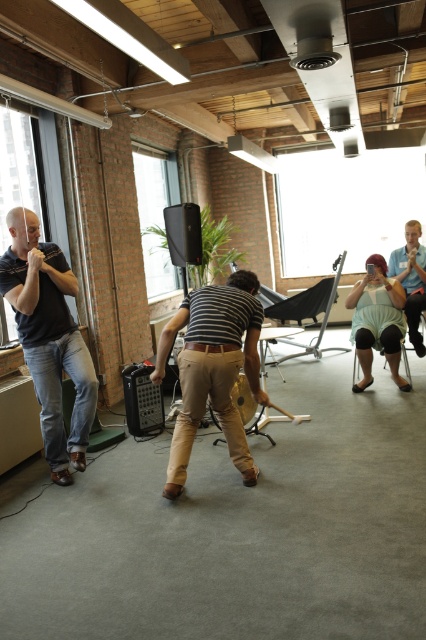
Is striped cotton shirt at center shorter than brown leather belt at center?

Incorrect, striped cotton shirt at center's height does not fall short of brown leather belt at center's.

Is striped cotton shirt at center above brown leather belt at center?

No.

This screenshot has height=640, width=426. Find the location of `striped cotton shirt at center`. striped cotton shirt at center is located at coordinates (213, 369).

Can you confirm if matte black shirt at left is wider than matte blue shirt at center?

Incorrect, matte black shirt at left's width does not surpass matte blue shirt at center's.

Looking at this image, does matte black shirt at left lie behind matte blue shirt at center?

No, it is in front of matte blue shirt at center.

Which is behind, point (69, 289) or point (373, 314)?

The point (373, 314) is more distant.

The height and width of the screenshot is (640, 426). Identify the location of matte black shirt at left. (48, 339).

Between matte black shirt at left and striped cotton shirt at center, which one appears on the right side from the viewer's perspective?

striped cotton shirt at center is more to the right.

In order to click on matte black shirt at left in this screenshot , I will do `click(48, 339)`.

This screenshot has width=426, height=640. Find the location of `matte black shirt at left`. matte black shirt at left is located at coordinates (48, 339).

Find the location of `matte black shirt at left`. matte black shirt at left is located at coordinates (48, 339).